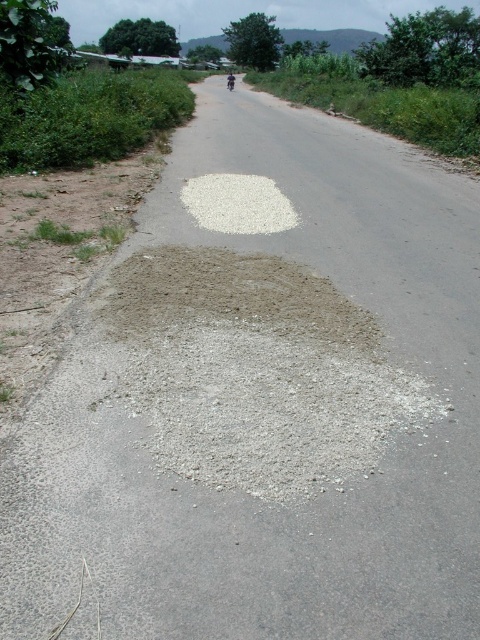
Which is in front, point (325, 282) or point (189, 186)?

Positioned in front is point (325, 282).

Is gray gravel at center below white gravel at center?

Yes.

Who is more distant from viewer, (314, 416) or (262, 196)?

The point (262, 196) is behind.

Locate an element on the screen. The height and width of the screenshot is (640, 480). gray gravel at center is located at coordinates (254, 371).

Which is behind, point (324, 449) or point (228, 81)?

Point (228, 81)

Between gray gravel at center and metallic silver motorcycle at center, which one has less height?

With less height is gray gravel at center.

Describe the element at coordinates (254, 371) in the screenshot. The width and height of the screenshot is (480, 640). I see `gray gravel at center` at that location.

In order to click on gray gravel at center in this screenshot , I will do `click(254, 371)`.

Is white gravel at center shorter than metallic silver motorcycle at center?

Yes.

Who is shorter, white gravel at center or metallic silver motorcycle at center?

With less height is white gravel at center.

Identify the location of white gravel at center. (238, 204).

Image resolution: width=480 pixels, height=640 pixels. I want to click on white gravel at center, so click(238, 204).